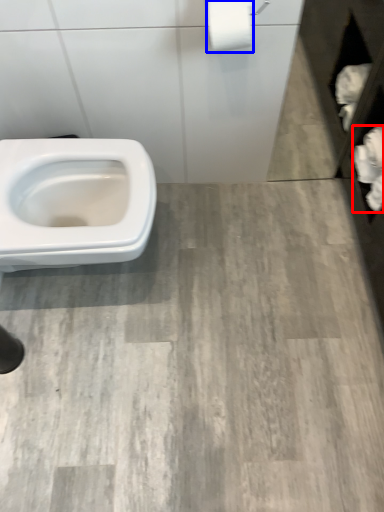
Question: Which object is further to the camera taking this photo, toilet paper (highlighted by a red box) or toilet paper (highlighted by a blue box)?

Choices:
 (A) toilet paper
 (B) toilet paper

Answer: (A)